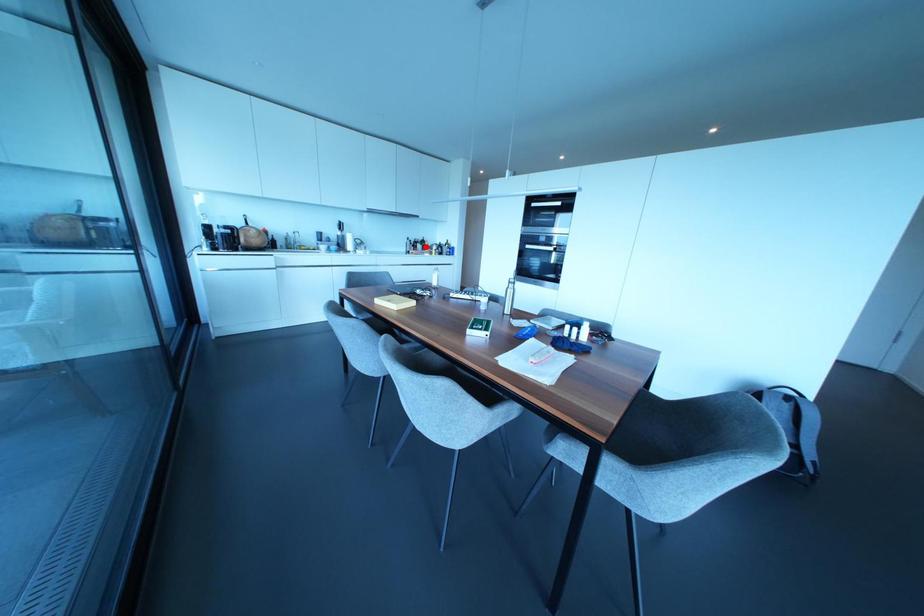
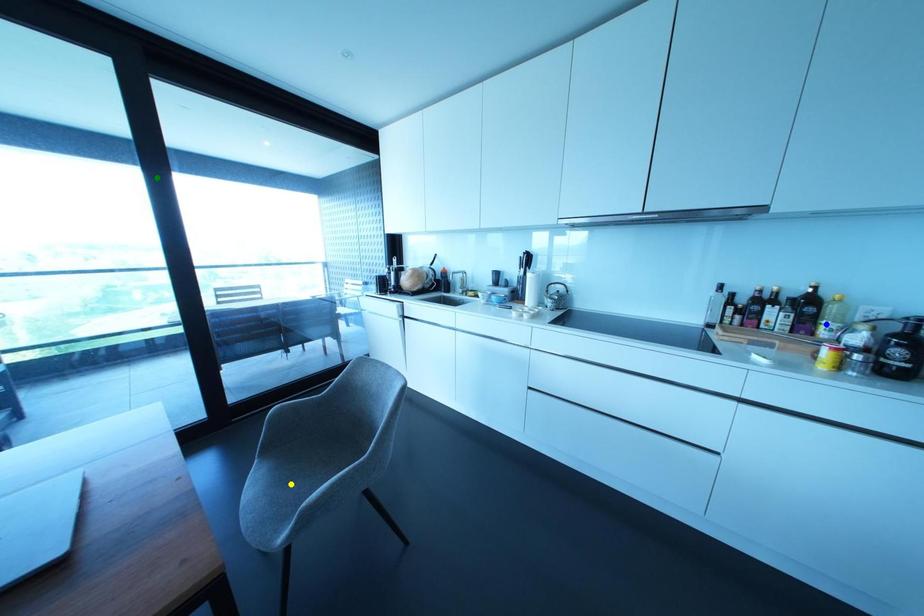
Question: I am providing you with two images of the same scene from different viewpoints. A red point is marked on the first image. You are given multiple points on the second image. Which mark in image 2 goes with the point in image 1?

Choices:
 (A) blue point
 (B) yellow point
 (C) green point

Answer: (A)